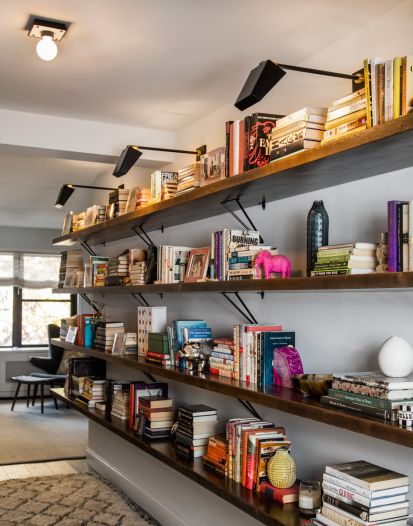
Identify the location of shelves. (304, 284), (272, 164), (188, 379), (161, 461).